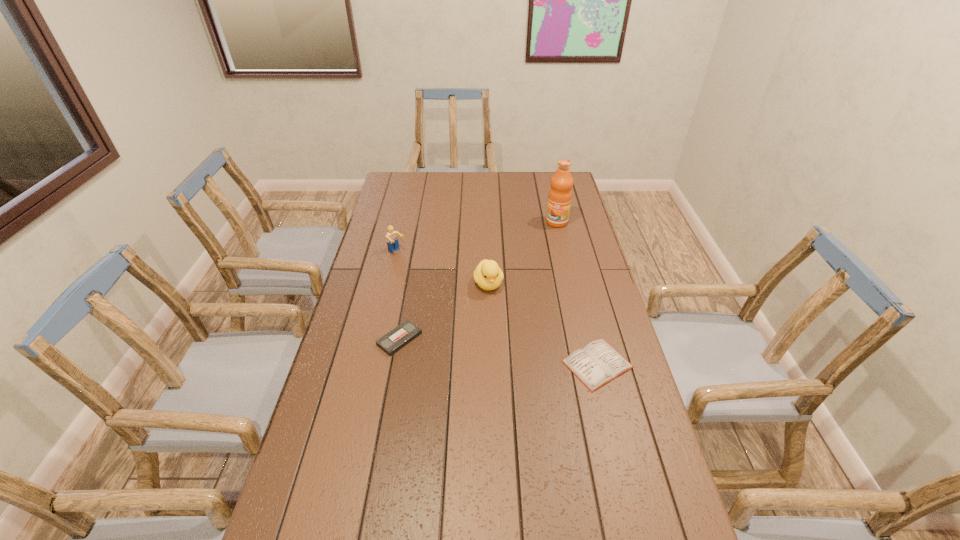
This screenshot has width=960, height=540. Find the location of `diary that is positioned at the right edge`. diary that is positioned at the right edge is located at coordinates (598, 363).

Identify the location of fruit juice at the right edge. (559, 200).

Find the location of a particular element. free space at the far edge is located at coordinates (442, 172).

Locate an element on the screen. vacant area at the near edge of the desktop is located at coordinates (435, 539).

I want to click on vacant space at the left edge of the desktop, so click(x=380, y=365).

In the image, there is a desktop. Identify the location of vacant space at the right edge. (578, 310).

Where is `free space at the far left corner of the desktop`? The image size is (960, 540). free space at the far left corner of the desktop is located at coordinates (408, 172).

Where is `vacant area at the far right corner`? Image resolution: width=960 pixels, height=540 pixels. vacant area at the far right corner is located at coordinates (546, 172).

The height and width of the screenshot is (540, 960). In order to click on free area in between the third nearest object and the tallest object in this screenshot , I will do 522,253.

I want to click on free space between the fruit juice and the second farthest object, so click(x=477, y=237).